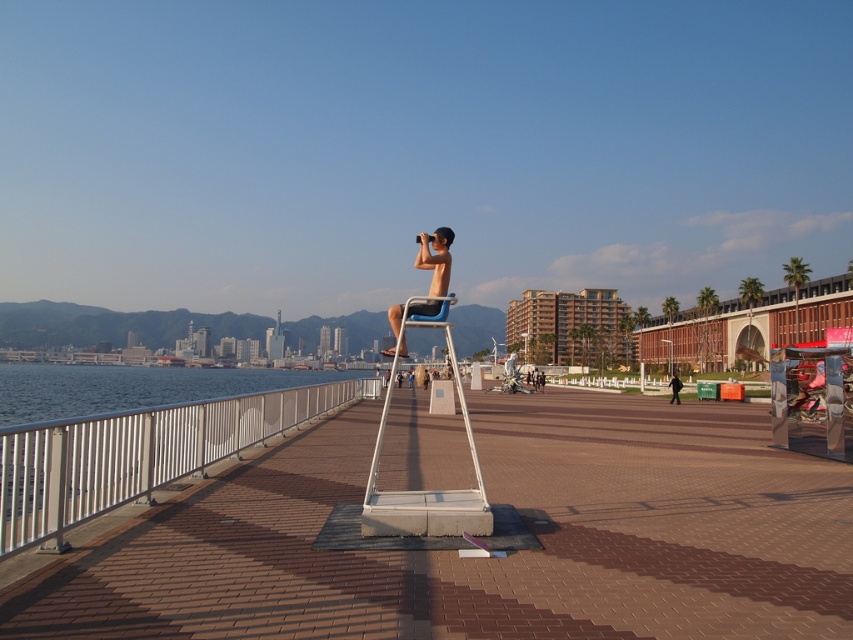
Question: Based on their relative distances, which object is nearer to the shiny metallic chair at center?

Choices:
 (A) silver metallic railing at left
 (B) white concrete dock at center

Answer: (B)

Question: Does silver metallic railing at left have a smaller size compared to shiny metallic chair at center?

Choices:
 (A) no
 (B) yes

Answer: (A)

Question: Does silver metallic railing at left appear on the right side of shiny metallic chair at center?

Choices:
 (A) yes
 (B) no

Answer: (B)

Question: Among these points, which one is nearest to the camera?

Choices:
 (A) (527, 634)
 (B) (434, 294)

Answer: (A)

Question: Which point appears farthest from the camera in this image?

Choices:
 (A) (582, 426)
 (B) (676, 381)
 (C) (480, 493)

Answer: (B)

Question: Is the position of white concrete dock at center less distant than that of black fabric person at center?

Choices:
 (A) no
 (B) yes

Answer: (B)